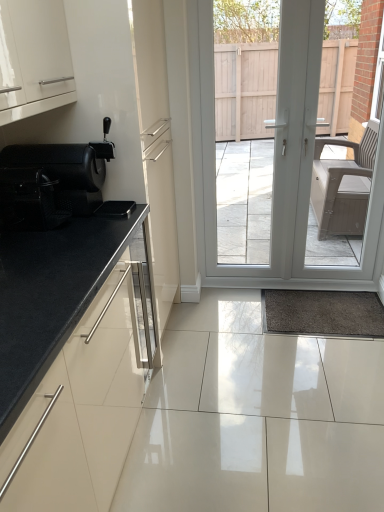
Question: From the image's perspective, does white glossy door at center appear higher than black mesh chair at left?

Choices:
 (A) yes
 (B) no

Answer: (A)

Question: Is white glossy door at center closer to the viewer compared to black mesh chair at left?

Choices:
 (A) no
 (B) yes

Answer: (A)

Question: Does white glossy door at center have a greater height compared to black mesh chair at left?

Choices:
 (A) yes
 (B) no

Answer: (A)

Question: From a real-world perspective, is white glossy door at center beneath black mesh chair at left?

Choices:
 (A) yes
 (B) no

Answer: (A)

Question: Considering the relative positions of white glossy door at center and black mesh chair at left in the image provided, is white glossy door at center behind black mesh chair at left?

Choices:
 (A) yes
 (B) no

Answer: (A)

Question: In terms of width, does black granite countertop at left look wider or thinner when compared to black mesh chair at left?

Choices:
 (A) thin
 (B) wide

Answer: (B)

Question: Based on their sizes in the image, would you say black granite countertop at left is bigger or smaller than black mesh chair at left?

Choices:
 (A) big
 (B) small

Answer: (A)

Question: Would you say black granite countertop at left is to the left or to the right of black mesh chair at left in the picture?

Choices:
 (A) right
 (B) left

Answer: (A)

Question: From the image's perspective, is black granite countertop at left positioned above or below black mesh chair at left?

Choices:
 (A) above
 (B) below

Answer: (B)

Question: Based on their positions, is white glossy door at center located to the left or right of black mesh chair at left?

Choices:
 (A) left
 (B) right

Answer: (B)

Question: In terms of height, does white glossy door at center look taller or shorter compared to black mesh chair at left?

Choices:
 (A) short
 (B) tall

Answer: (B)

Question: From a real-world perspective, is white glossy door at center above or below black mesh chair at left?

Choices:
 (A) above
 (B) below

Answer: (B)

Question: Based on their sizes in the image, would you say white glossy door at center is bigger or smaller than black mesh chair at left?

Choices:
 (A) small
 (B) big

Answer: (B)

Question: From a real-world perspective, is black granite countertop at left physically located above or below white glossy door at center?

Choices:
 (A) above
 (B) below

Answer: (B)

Question: Does point (61, 345) appear closer or farther from the camera than point (306, 16)?

Choices:
 (A) closer
 (B) farther

Answer: (A)